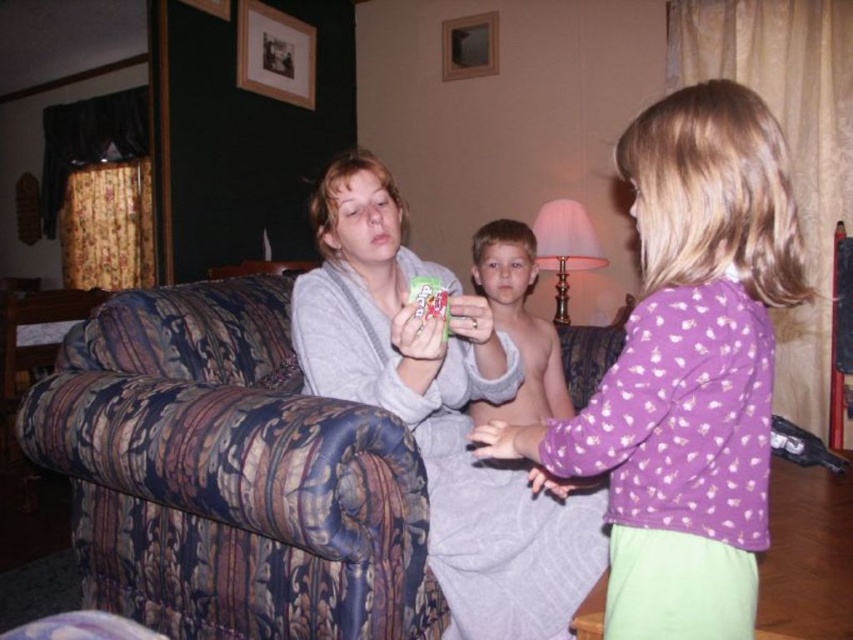
Question: Which of these objects is positioned closest to the smooth skin boy at center?

Choices:
 (A) purple cotton shirt at center
 (B) patterned fabric couch at center
 (C) gray soft blanket at center

Answer: (C)

Question: Is patterned fabric couch at center to the left of gray soft blanket at center from the viewer's perspective?

Choices:
 (A) no
 (B) yes

Answer: (B)

Question: Can you confirm if patterned fabric couch at center is smaller than smooth skin boy at center?

Choices:
 (A) yes
 (B) no

Answer: (B)

Question: Can you confirm if gray soft blanket at center is positioned to the left of smooth skin boy at center?

Choices:
 (A) no
 (B) yes

Answer: (B)

Question: Which object is closer to the camera taking this photo?

Choices:
 (A) gray soft blanket at center
 (B) smooth skin boy at center

Answer: (A)

Question: Which of the following is the closest to the observer?

Choices:
 (A) (167, 461)
 (B) (654, 122)
 (C) (508, 298)
 (D) (491, 502)

Answer: (B)